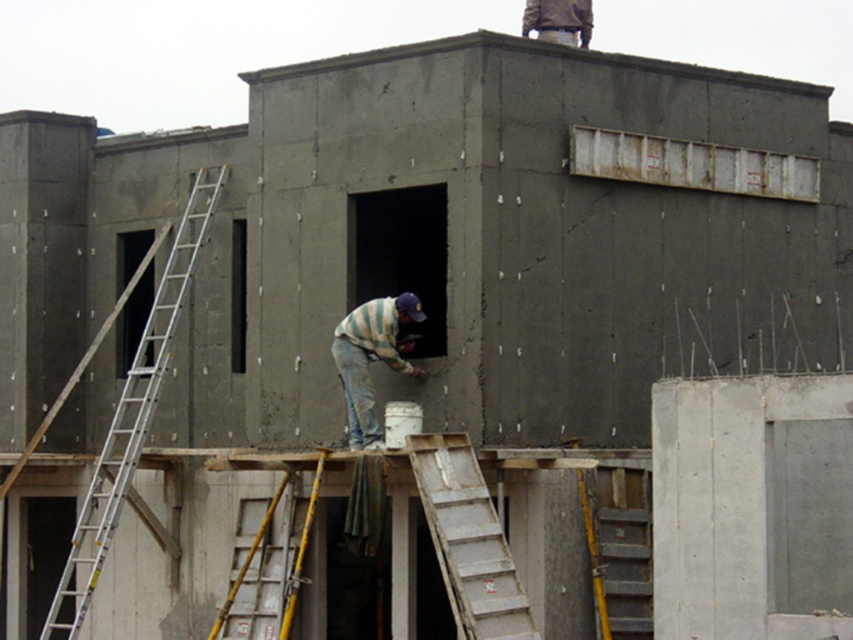
Based on the photo, please provide the coordinates of the silver metallic ladder at left in the image.

The silver metallic ladder at left is located at coordinates point (x=131, y=417).

You are a worker at the construction site and need to climb up to the second floor. You see a silver metallic ladder at left and a striped sweater at center. Which object is bigger and can provide better support for climbing?

The silver metallic ladder at left is larger in size compared to the striped sweater at center, so it can provide better support for climbing.